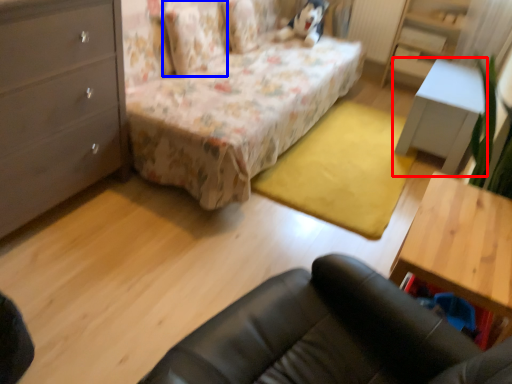
Question: Which point is further to the camera, table (highlighted by a red box) or pillow (highlighted by a blue box)?

Choices:
 (A) table
 (B) pillow

Answer: (A)